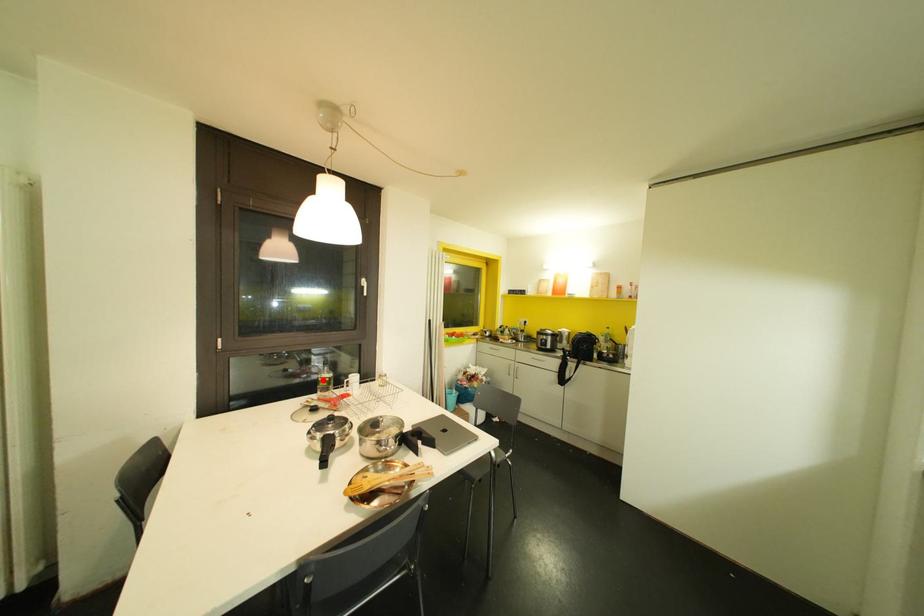
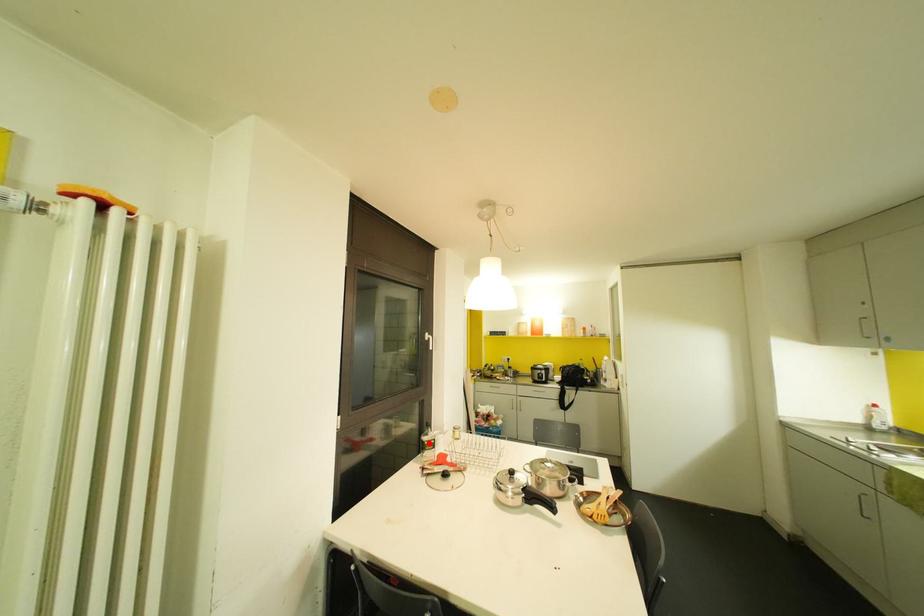
I am providing you with two images of the same scene from different viewpoints. A red point is marked on the first image and another point is marked on the second image. Is the red point in image1 aligned with the point shown in image2?

Yes